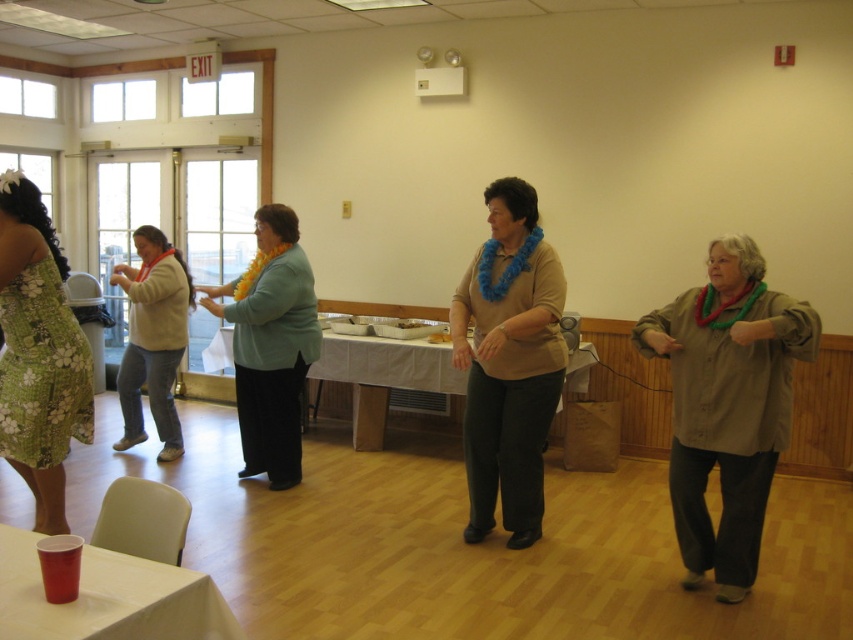
You are standing at the entrance of the community center and see the matte brown shirt at right. If you want to move towards it, which direction should you walk?

A: The matte brown shirt at right is located at point 0.634 on the x and 0.853 on the y, so you should walk towards the right side of the room and slightly forward to reach it.

You are at a community event and need to grab your drink. You see the red plastic cup at lower left and the matte brown shirt at right. Which object is closer to you?

The red plastic cup at lower left is behind matte brown shirt at right, so the matte brown shirt at right is closer to you.

What are the coordinates of the green floral dress at left in the image?

The green floral dress at left is located at coordinates point (38, 353).